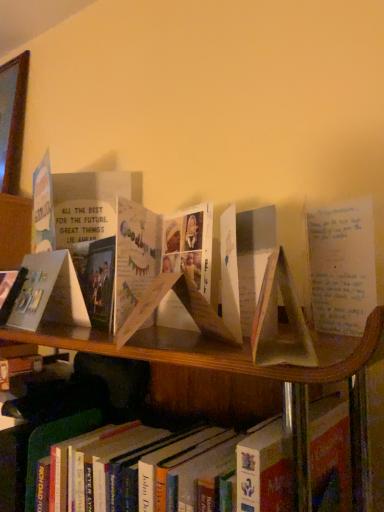
Question: Does hardcover book at lower center have a lesser height compared to matte paper book at center, positioned as the 1th paperback book in front-to-back order?

Choices:
 (A) yes
 (B) no

Answer: (B)

Question: Is hardcover book at lower center further to camera compared to matte paper book at center, which is the first paperback book in right-to-left order?

Choices:
 (A) yes
 (B) no

Answer: (A)

Question: Is hardcover book at lower center at the left side of matte paper book at center, positioned as the 1th paperback book in front-to-back order?

Choices:
 (A) yes
 (B) no

Answer: (A)

Question: Is hardcover book at lower center aimed at matte paper book at center, which is counted as the 2th paperback book, starting from the back?

Choices:
 (A) no
 (B) yes

Answer: (A)

Question: Are hardcover book at lower center and matte paper book at center, the 2th paperback book in the left-to-right sequence, beside each other?

Choices:
 (A) no
 (B) yes

Answer: (A)

Question: From a real-world perspective, is matte paper card at left, marked as the 2th paperback book in a right-to-left arrangement, above or below matte paper book at center, positioned as the 1th paperback book in front-to-back order?

Choices:
 (A) above
 (B) below

Answer: (A)

Question: Based on their positions, is matte paper card at left, the 2th paperback book viewed from the front, located to the left or right of matte paper book at center, which is the first paperback book in right-to-left order?

Choices:
 (A) left
 (B) right

Answer: (A)

Question: Considering the positions of matte paper card at left, marked as the 2th paperback book in a right-to-left arrangement, and matte paper book at center, which is the first paperback book in right-to-left order, in the image, is matte paper card at left, marked as the 2th paperback book in a right-to-left arrangement, bigger or smaller than matte paper book at center, which is the first paperback book in right-to-left order,?

Choices:
 (A) small
 (B) big

Answer: (B)

Question: From the image's perspective, is matte paper card at left, acting as the first paperback book starting from the back, located above or below matte paper book at center, positioned as the 1th paperback book in front-to-back order?

Choices:
 (A) above
 (B) below

Answer: (B)

Question: Looking at their shapes, would you say matte paper book at center, positioned as the 1th paperback book in front-to-back order, is wider or thinner than hardcover book at lower center?

Choices:
 (A) thin
 (B) wide

Answer: (A)

Question: Is point (243, 301) closer or farther from the camera than point (188, 443)?

Choices:
 (A) farther
 (B) closer

Answer: (B)

Question: From the image's perspective, relative to hardcover book at lower center, is matte paper book at center, which is the first paperback book in right-to-left order, above or below?

Choices:
 (A) below
 (B) above

Answer: (B)

Question: Is matte paper book at center, the 2th paperback book in the left-to-right sequence, bigger or smaller than hardcover book at lower center?

Choices:
 (A) big
 (B) small

Answer: (B)

Question: In terms of width, does matte paper card at left, which is the first paperback book from left to right, look wider or thinner when compared to hardcover book at lower center?

Choices:
 (A) wide
 (B) thin

Answer: (B)

Question: Does point (61, 314) appear closer or farther from the camera than point (337, 484)?

Choices:
 (A) farther
 (B) closer

Answer: (A)